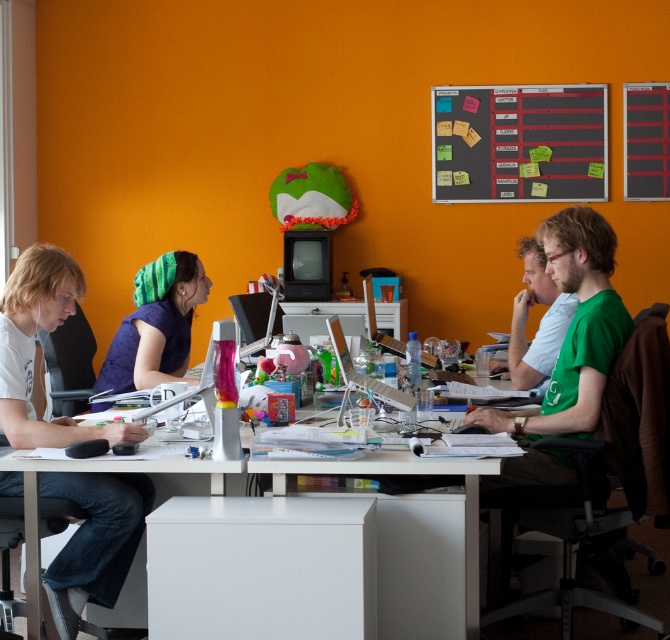
You are a delivery person who needs to place a small package on the desk. The package requires 28 inches of space. Can the green matte shirt at right and the white plastic computer desk at center accommodate the package between them?

The green matte shirt at right is 27.46 inches from the white plastic computer desk at center, which is less than the required 28 inches. Therefore, the package cannot be placed between them.